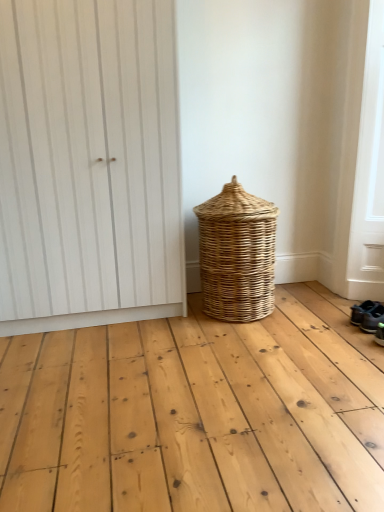
Question: Is point (362, 322) positioned closer to the camera than point (56, 207)?

Choices:
 (A) closer
 (B) farther

Answer: (B)

Question: In terms of size, does dark gray fabric shoe at lower right, the first footwear from the front, appear bigger or smaller than white wood door at upper left?

Choices:
 (A) small
 (B) big

Answer: (A)

Question: Estimate the real-world distances between objects in this image. Which object is closer to the white wood door at upper left?

Choices:
 (A) white textured screen door at lower right
 (B) dark blue fabric sneakers at lower right, the 2th footwear when ordered from front to back
 (C) woven natural basket at center
 (D) dark gray fabric shoe at lower right, the first footwear from the front

Answer: (C)

Question: Estimate the real-world distances between objects in this image. Which object is closer to the woven natural basket at center?

Choices:
 (A) dark blue fabric sneakers at lower right, acting as the 1th footwear starting from the back
 (B) dark gray fabric shoe at lower right, the first footwear from the front
 (C) white wood door at upper left
 (D) white textured screen door at lower right

Answer: (C)